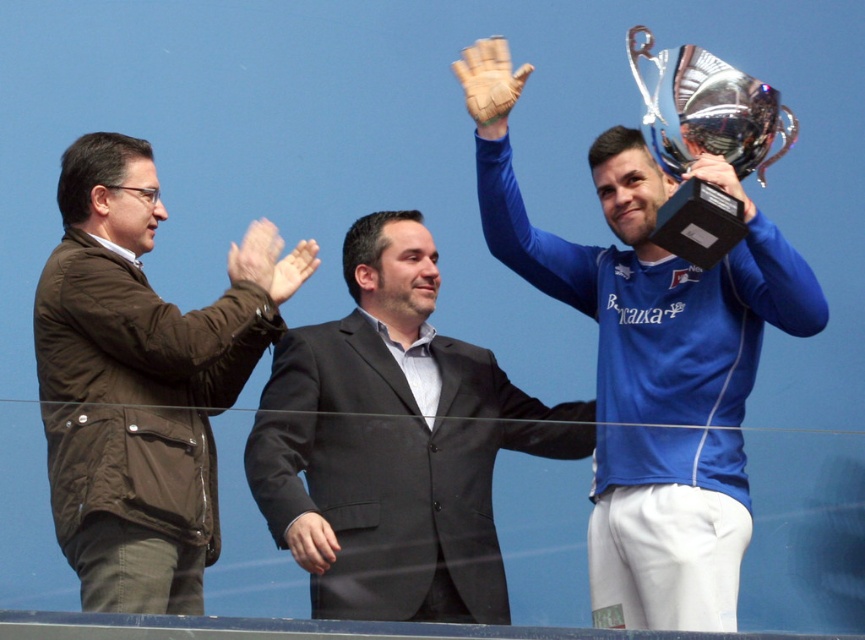
Question: Which of the following is the closest to the observer?

Choices:
 (A) black suit at center
 (B) leather glove at upper center

Answer: (A)

Question: Does brown puffy jacket at left appear on the left side of metallic silver trophy at upper right?

Choices:
 (A) no
 (B) yes

Answer: (B)

Question: Is black suit at center positioned behind silver metallic trophy at upper right?

Choices:
 (A) no
 (B) yes

Answer: (A)

Question: Among these objects, which one is nearest to the camera?

Choices:
 (A) black suit at center
 (B) metallic silver trophy at upper right

Answer: (A)

Question: From the image, what is the correct spatial relationship of black suit at center in relation to matte brown glove at upper center?

Choices:
 (A) right
 (B) left

Answer: (A)

Question: Which of the following is the farthest from the observer?

Choices:
 (A) black suit at center
 (B) matte brown glove at upper center
 (C) leather glove at upper center

Answer: (C)